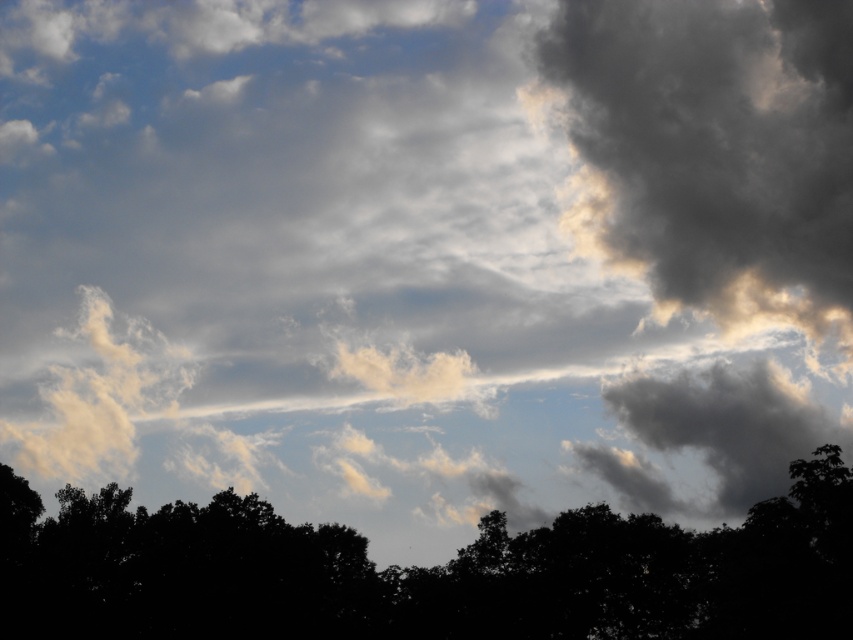
Between point (664, 557) and point (726, 163), which one is positioned in front?

Point (664, 557) is more forward.

Which is above, black matte tree at bottom or dark gray fluffy cloud at upper right?

dark gray fluffy cloud at upper right

Does point (68, 628) come in front of point (596, 52)?

Yes, point (68, 628) is closer to viewer.

Find the location of a particular element. This screenshot has width=853, height=640. black matte tree at bottom is located at coordinates (424, 572).